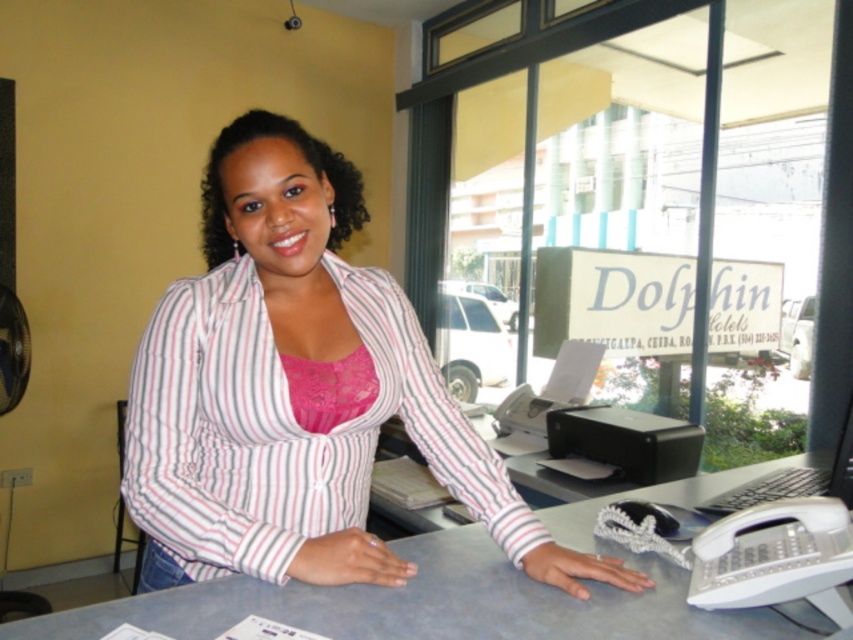
Is striped cotton shirt at center further to camera compared to gray matte table at center?

Yes, striped cotton shirt at center is behind gray matte table at center.

Does point (425, 444) come farther from viewer compared to point (722, 484)?

No, (425, 444) is closer to viewer.

Locate an element on the screen. This screenshot has width=853, height=640. striped cotton shirt at center is located at coordinates (285, 429).

Can you confirm if striped cotton shirt at center is positioned to the left of black plastic computer at lower right?

Correct, you'll find striped cotton shirt at center to the left of black plastic computer at lower right.

Does striped cotton shirt at center have a lesser width compared to black plastic computer at lower right?

In fact, striped cotton shirt at center might be wider than black plastic computer at lower right.

I want to click on striped cotton shirt at center, so click(285, 429).

Can you confirm if gray matte table at center is shorter than black plastic computer at lower right?

Indeed, gray matte table at center has a lesser height compared to black plastic computer at lower right.

Between point (100, 609) and point (795, 476), which one is positioned behind?

Positioned behind is point (795, 476).

This screenshot has width=853, height=640. What are the coordinates of `gray matte table at center` in the screenshot? It's located at (454, 593).